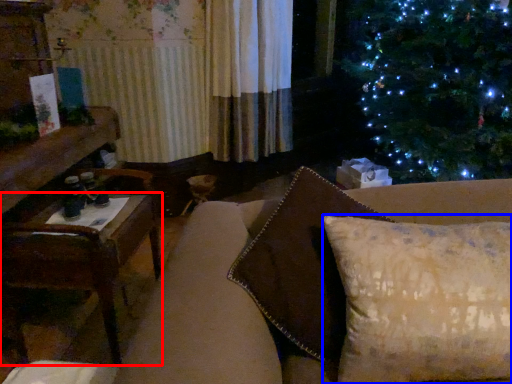
Question: Which of the following is the farthest to the observer, table (highlighted by a red box) or pillow (highlighted by a blue box)?

Choices:
 (A) table
 (B) pillow

Answer: (A)